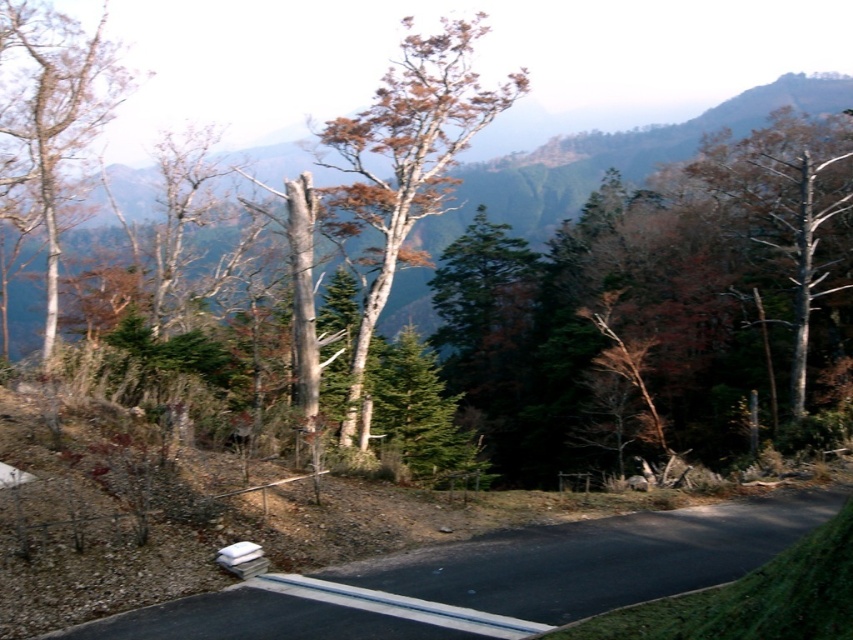
You are a hiker standing on the paved road and want to identify the tallest tree between the brown bark tree at center and the smooth white tree at left. Which one should you point to?

The brown bark tree at center is taller than the smooth white tree at left, so you should point to the brown bark tree at center.

You are standing at the point with coordinates point (61, 115) and want to walk towards the point (462, 589). Which direction should you move to get closer to your destination?

Since point (462, 589) is closer to the viewer than point (61, 115), you should move forward towards the point (462, 589) to get closer to your destination.

You are a hiker planning to walk from the black asphalt road at lower center to the brown bark tree at center. Given that your average walking speed is 1.5 meters per second, how many seconds will it take you to reach the tree?

The distance between the black asphalt road at lower center and the brown bark tree at center is 82.88 meters. At a walking speed of 1.5 meters per second, it would take approximately 55.25 seconds to reach the tree.